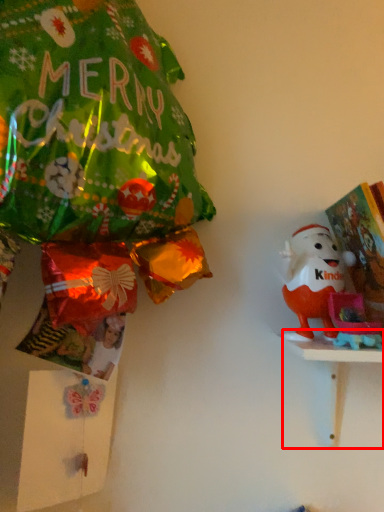
Question: Where is table (annotated by the red box) located in relation to toy in the image?

Choices:
 (A) left
 (B) right

Answer: (B)